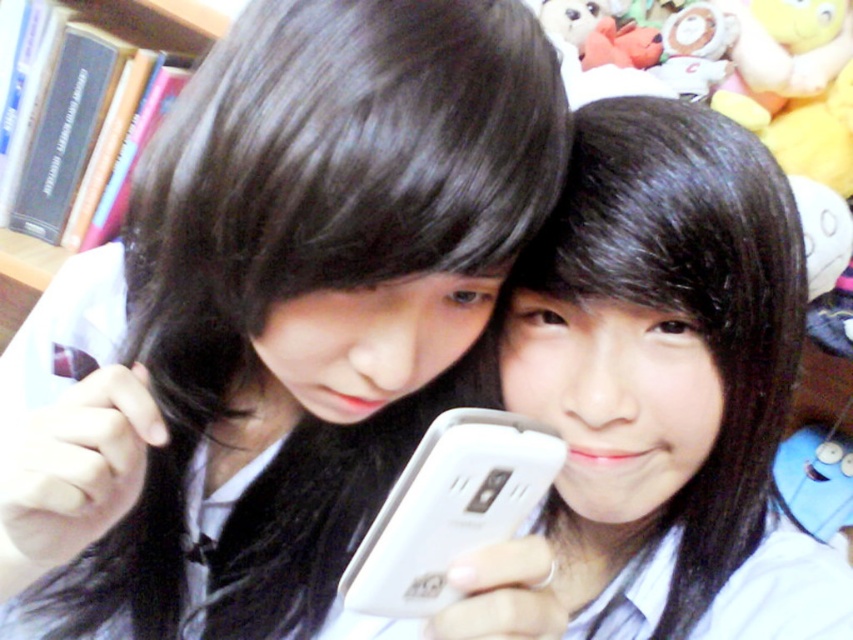
Who is more forward, (x=604, y=257) or (x=440, y=481)?

Positioned in front is point (x=440, y=481).

Can you confirm if white matte phone at center is bigger than white plastic smartphone at center?

Indeed, white matte phone at center has a larger size compared to white plastic smartphone at center.

I want to click on white matte phone at center, so click(x=668, y=378).